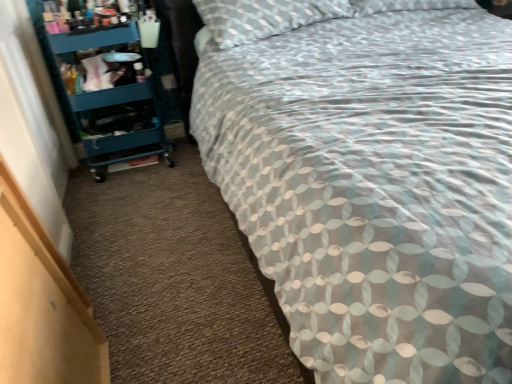
The height and width of the screenshot is (384, 512). I want to click on patterned fabric bed at center, so click(369, 177).

Measure the distance between point (221, 21) and camera.

The depth of point (221, 21) is 7.02 feet.

The height and width of the screenshot is (384, 512). Describe the element at coordinates (369, 177) in the screenshot. I see `patterned fabric bed at center` at that location.

What is the approximate height of patterned fabric bed at center?

patterned fabric bed at center is 3.41 feet in height.

Locate an element on the screen. This screenshot has width=512, height=384. teal plastic cart at left is located at coordinates (103, 80).

The height and width of the screenshot is (384, 512). Describe the element at coordinates (103, 80) in the screenshot. I see `teal plastic cart at left` at that location.

Locate an element on the screen. This screenshot has width=512, height=384. patterned fabric bed at center is located at coordinates (369, 177).

Is patterned fabric bed at center at the right side of teal plastic cart at left?

Correct, you'll find patterned fabric bed at center to the right of teal plastic cart at left.

Is patterned fabric bed at center in front of teal plastic cart at left?

Yes, it is in front of teal plastic cart at left.

Which point is more distant from viewer, (450, 9) or (131, 17)?

Positioned behind is point (450, 9).

From the image's perspective, is patterned fabric bed at center over teal plastic cart at left?

No, from the image's perspective, patterned fabric bed at center is not on top of teal plastic cart at left.

From a real-world perspective, who is located lower, patterned fabric bed at center or teal plastic cart at left?

teal plastic cart at left.

Which object is wider, patterned fabric bed at center or teal plastic cart at left?

Wider between the two is patterned fabric bed at center.

Considering the relative sizes of patterned fabric bed at center and teal plastic cart at left in the image provided, is patterned fabric bed at center shorter than teal plastic cart at left?

No, patterned fabric bed at center is not shorter than teal plastic cart at left.

Can you confirm if patterned fabric bed at center is smaller than teal plastic cart at left?

No, patterned fabric bed at center is not smaller than teal plastic cart at left.

Looking at this image, is patterned fabric bed at center inside or outside of teal plastic cart at left?

patterned fabric bed at center cannot be found inside teal plastic cart at left.

Would you say patterned fabric bed at center is a long distance from teal plastic cart at left?

That's not correct — patterned fabric bed at center is a little close to teal plastic cart at left.

Could you tell me if patterned fabric bed at center is facing teal plastic cart at left?

No, patterned fabric bed at center is not aimed at teal plastic cart at left.

The height and width of the screenshot is (384, 512). I want to click on bed positioned vertically above the teal plastic cart at left (from a real-world perspective), so click(369, 177).

Which is more to the right, teal plastic cart at left or patterned fabric bed at center?

patterned fabric bed at center.

Is the position of teal plastic cart at left less distant than that of patterned fabric bed at center?

No, the depth of teal plastic cart at left is greater than that of patterned fabric bed at center.

Considering the points (142, 69) and (380, 13), which point is behind, point (142, 69) or point (380, 13)?

The point (380, 13) is farther from the camera.

From the image's perspective, which one is positioned higher, teal plastic cart at left or patterned fabric bed at center?

teal plastic cart at left, from the image's perspective.

From a real-world perspective, which is physically below, teal plastic cart at left or patterned fabric bed at center?

teal plastic cart at left is physically lower.

Can you confirm if teal plastic cart at left is thinner than patterned fabric bed at center?

Yes.

Considering the sizes of teal plastic cart at left and patterned fabric bed at center in the image, is teal plastic cart at left taller or shorter than patterned fabric bed at center?

Considering their sizes, teal plastic cart at left has less height than patterned fabric bed at center.

Is teal plastic cart at left smaller than patterned fabric bed at center?

Yes.

Is teal plastic cart at left situated inside patterned fabric bed at center or outside?

teal plastic cart at left is outside patterned fabric bed at center.

Is there a large distance between teal plastic cart at left and patterned fabric bed at center?

No, teal plastic cart at left is not far from patterned fabric bed at center.

Is teal plastic cart at left facing away from patterned fabric bed at center?

No, teal plastic cart at left is not facing the opposite direction of patterned fabric bed at center.

Can you tell me how much teal plastic cart at left and patterned fabric bed at center differ in facing direction?

1.31 degrees.

Identify the location of bed on the right of the teal plastic cart at left. The image size is (512, 384). (369, 177).

Find the location of a particular element. This screenshot has width=512, height=384. shelf that is on the left side of patterned fabric bed at center is located at coordinates point(103,80).

This screenshot has height=384, width=512. I want to click on bed in front of the teal plastic cart at left, so click(x=369, y=177).